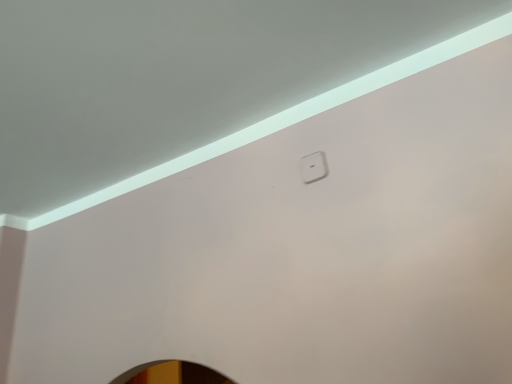
Identify the location of white plastic light switch at upper center. Image resolution: width=512 pixels, height=384 pixels. (313, 167).

Measure the distance between white plastic light switch at upper center and camera.

white plastic light switch at upper center and camera are 38.62 inches apart.

This screenshot has height=384, width=512. What do you see at coordinates (313, 167) in the screenshot? I see `white plastic light switch at upper center` at bounding box center [313, 167].

Where is `white plastic light switch at upper center`? The height and width of the screenshot is (384, 512). white plastic light switch at upper center is located at coordinates (313, 167).